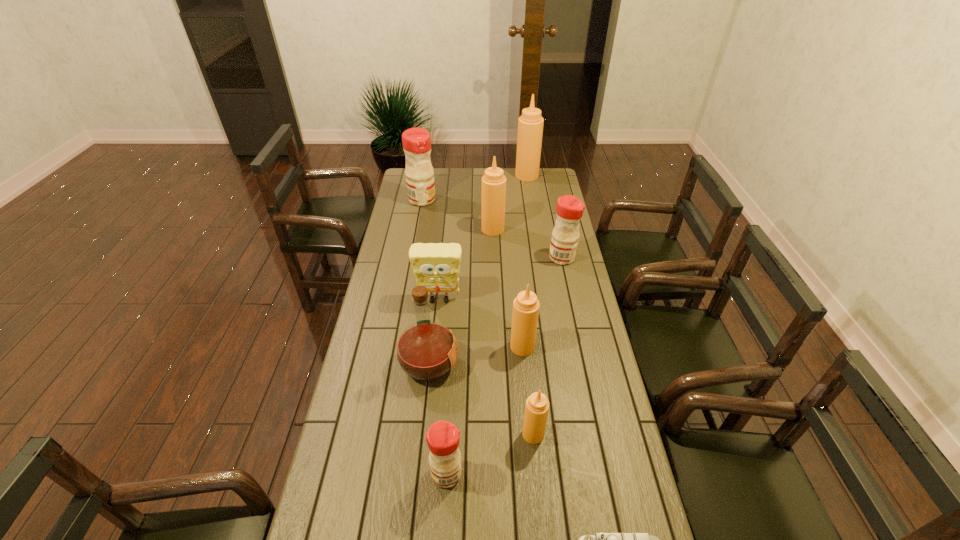
Locate an element on the screen. The width and height of the screenshot is (960, 540). the tallest condiment is located at coordinates (530, 124).

Locate an element on the screen. This screenshot has height=540, width=960. the tallest object is located at coordinates (530, 124).

I want to click on the second biggest tan condiment, so click(x=493, y=193).

The image size is (960, 540). I want to click on the third farthest condiment, so click(493, 193).

At what (x,y) coordinates should I click in order to perform the action: click on the leftmost red condiment. Please return your answer as a coordinate pair (x, y). This screenshot has height=540, width=960. Looking at the image, I should click on (416, 141).

This screenshot has height=540, width=960. I want to click on the farthest red condiment, so click(416, 141).

Where is `pink liquor`? pink liquor is located at coordinates (426, 350).

This screenshot has width=960, height=540. In order to click on the second nearest tan condiment in this screenshot , I will do `click(526, 306)`.

Image resolution: width=960 pixels, height=540 pixels. I want to click on the third biggest tan condiment, so click(526, 306).

Find the location of a particular element. the seventh nearest object is located at coordinates (564, 242).